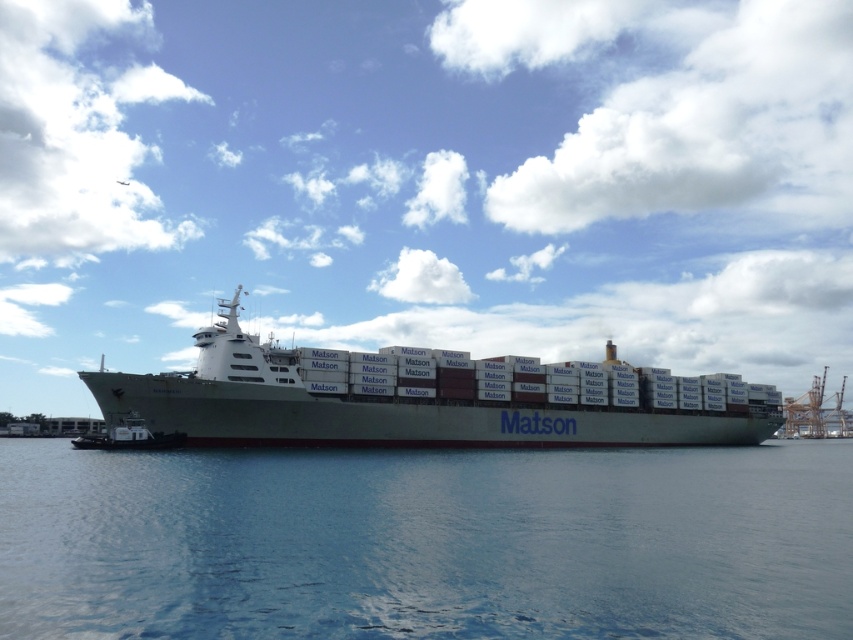
Looking at this image, based on the scene description, where is the blue water at center located in terms of its 2D coordinates?

The blue water at center is located at the 2D coordinates of point (426,541).

You are standing on the dock and looking at the blue water at center and the white matte container ship at center. Which object is positioned higher from the ground?

The white matte container ship at center is positioned higher than the blue water at center because the blue water at center is located below it.

You are standing on the dock and want to take a photo of the Matson ship. The camera you have can only focus on objects within 100 feet. Is the point at coordinate point (316, 556) on the ship within the camera focus range?

The distance between point (316, 556) and the camera is 101.88 feet, which is beyond the camera focus range of 100 feet. Therefore, the camera cannot focus on that point.